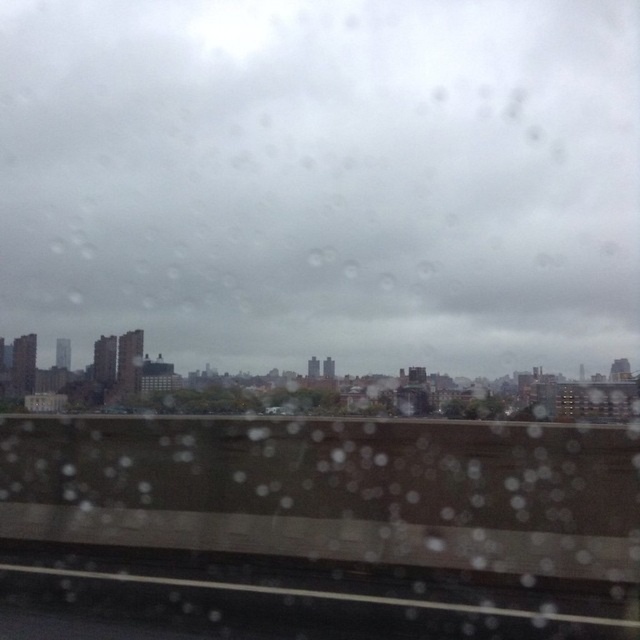
Can you confirm if transparent glass at upper center is shorter than black rubber train track at lower center?

Incorrect, transparent glass at upper center's height does not fall short of black rubber train track at lower center's.

Does transparent glass at upper center appear under black rubber train track at lower center?

No, transparent glass at upper center is not below black rubber train track at lower center.

This screenshot has height=640, width=640. What are the coordinates of `transparent glass at upper center` in the screenshot? It's located at (323, 179).